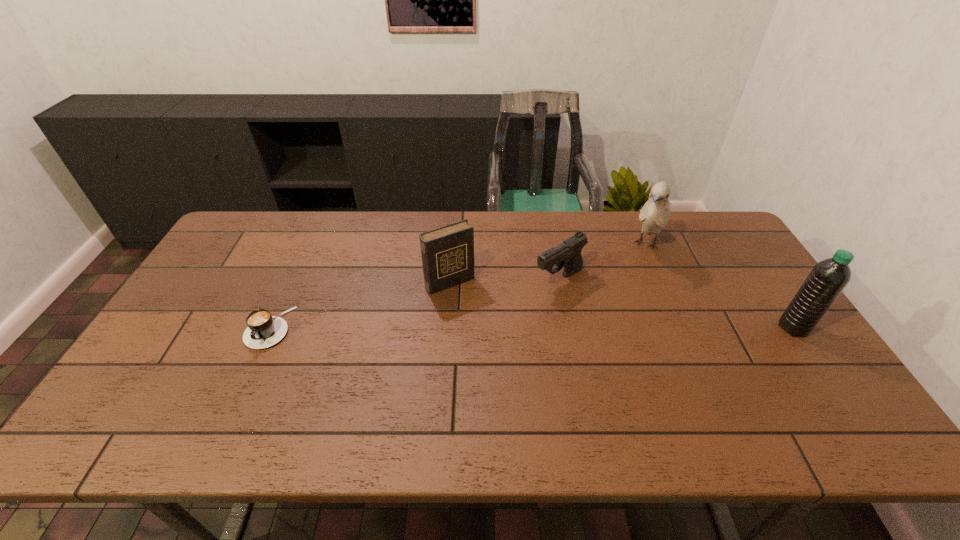
The height and width of the screenshot is (540, 960). In order to click on the shortest object in this screenshot , I will do click(264, 330).

What are the coordinates of `the leftmost object` in the screenshot? It's located at (264, 330).

Where is `water bottle`? Image resolution: width=960 pixels, height=540 pixels. water bottle is located at coordinates (827, 279).

The image size is (960, 540). I want to click on pistol, so click(x=567, y=254).

Image resolution: width=960 pixels, height=540 pixels. I want to click on the third object from right to left, so click(567, 254).

What are the coordinates of `diary` in the screenshot? It's located at (447, 253).

Find the location of a particular element. the second object from left to right is located at coordinates (447, 253).

This screenshot has width=960, height=540. I want to click on bird, so point(655,214).

The image size is (960, 540). I want to click on vacant area situated 0.360m on the back of the water bottle, so tap(732, 238).

The image size is (960, 540). Identify the location of blank space located at the barrel of the third object from left to right. (438, 356).